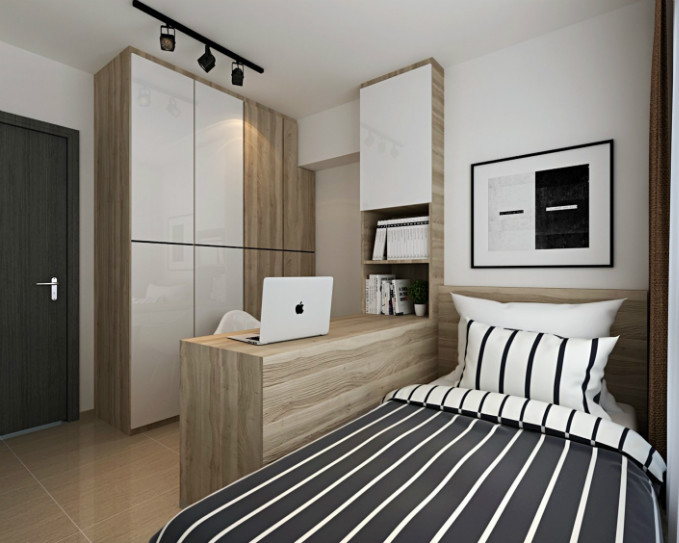
At what (x,y) coordinates should I click in order to perform the action: click on picture frame. Please return your answer as a coordinate pair (x, y). Looking at the image, I should click on (530, 157), (538, 262).